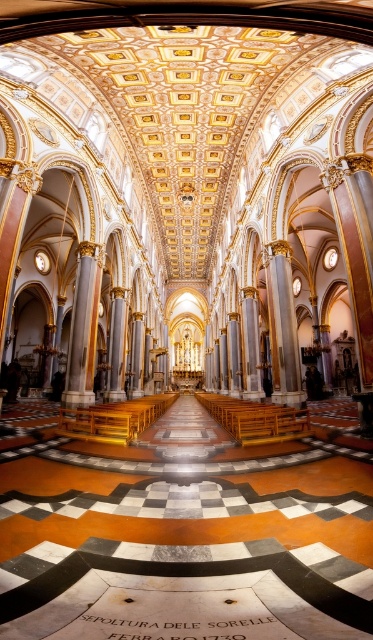
You are an architect visiting the cathedral and want to compare the columns in the nave. Which object is wider, the white marble column at center or the gold polished pillar at center?

The white marble column at center is wider than the gold polished pillar at center.

You are an architect visiting the cathedral and want to compare the two central columns. Which one is shorter between the white marble column at center and the gold polished pillar at center?

The white marble column at center is shorter than the gold polished pillar at center.

You are standing in the cathedral and want to locate the white marble column at center. According to the coordinates provided, where exactly would you find it?

The white marble column at center is located at coordinates point (83, 326).